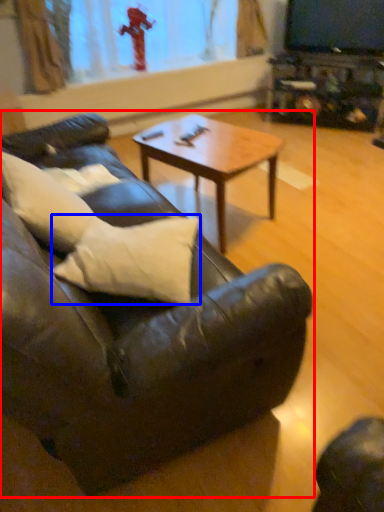
Question: Which of the following is the closest to the observer, studio couch (highlighted by a red box) or pillow (highlighted by a blue box)?

Choices:
 (A) studio couch
 (B) pillow

Answer: (A)